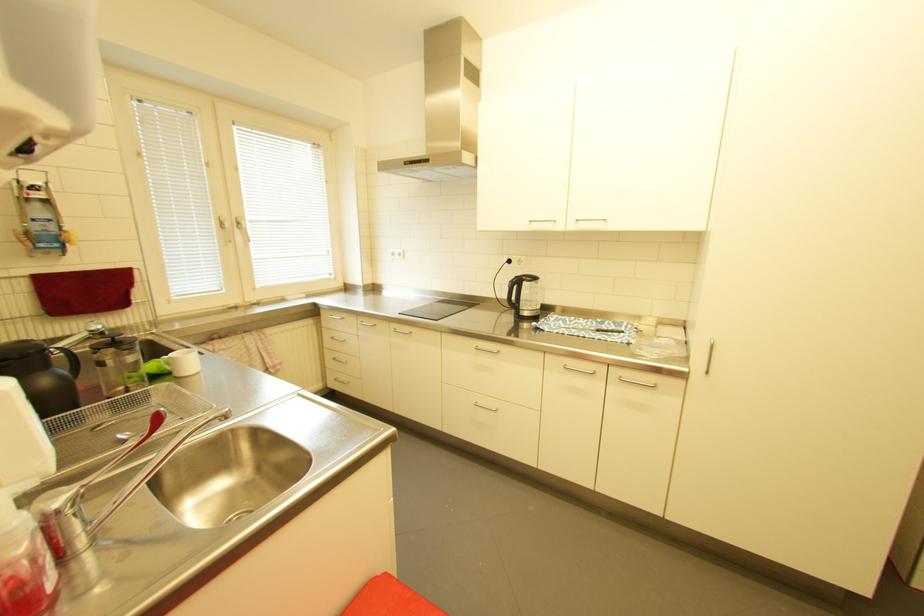
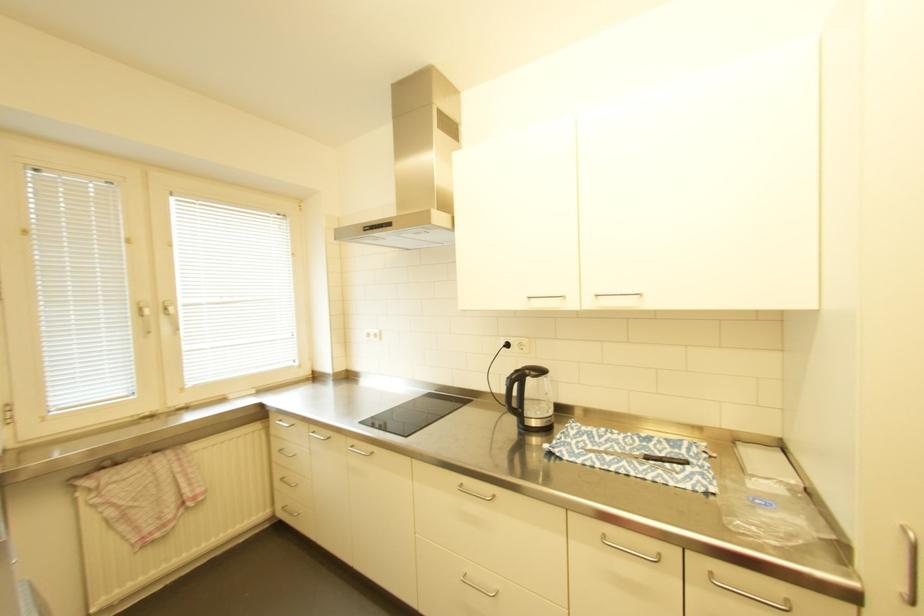
The point at (339, 315) is marked in the first image. Where is the corresponding point in the second image?

(287, 421)